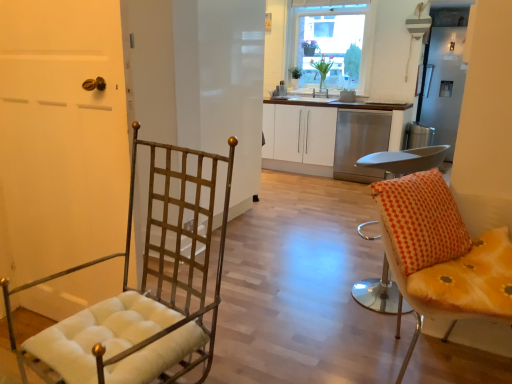
What are the coordinates of `free space in front of metallic grid screen door at center, the first screen door viewed from the left` in the screenshot? It's located at (256, 256).